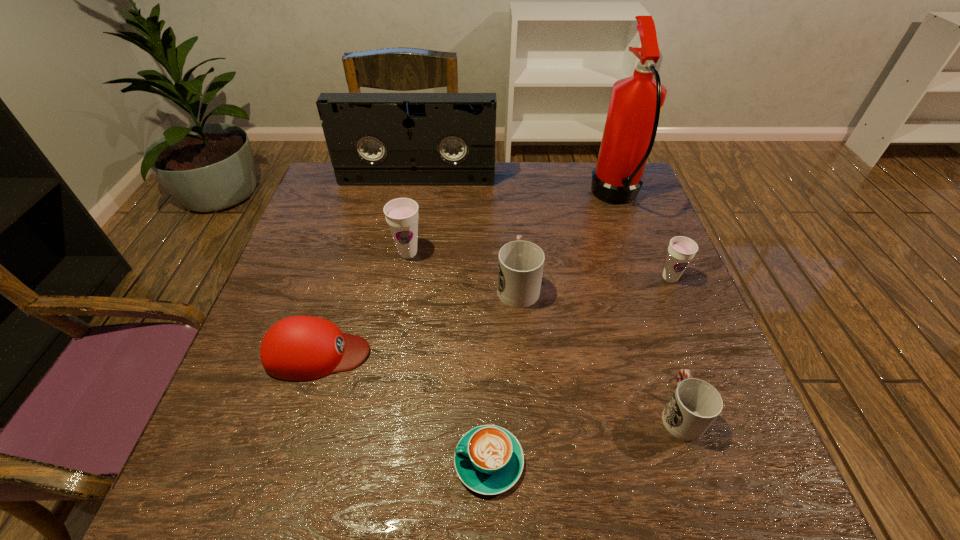
Locate an element on the screen. This screenshot has width=960, height=540. vacant area situated with the handle on the right side of the shortest object is located at coordinates (236, 462).

At what (x,y) coordinates should I click in order to perform the action: click on fire extinguisher that is positioned at the far edge. Please return your answer as a coordinate pair (x, y). The image size is (960, 540). Looking at the image, I should click on (636, 102).

Find the location of a particular element. This screenshot has width=960, height=540. videotape present at the far edge is located at coordinates (374, 139).

Locate an element on the screen. The image size is (960, 540). object that is positioned at the near edge is located at coordinates (489, 460).

You are a GUI agent. You are given a task and a screenshot of the screen. Output one action in this format:
    pyautogui.click(x=<x>, y=<y>)
    Task: Click on the videotape that is at the left edge
    The width and height of the screenshot is (960, 540).
    Given the screenshot: What is the action you would take?
    tap(374, 139)

You are a GUI agent. You are given a task and a screenshot of the screen. Output one action in this format:
    pyautogui.click(x=<x>, y=<y>)
    Task: Click on the baseball cap present at the left edge
    
    Given the screenshot: What is the action you would take?
    pyautogui.click(x=299, y=348)

Identify the location of fire extinguisher that is positioned at the right edge. 636,102.

Where is `object located at the far left corner`? object located at the far left corner is located at coordinates (374, 139).

The height and width of the screenshot is (540, 960). I want to click on object that is at the far right corner, so coord(636,102).

Locate an element on the screen. This screenshot has height=540, width=960. vacant space at the far edge of the desktop is located at coordinates point(591,202).